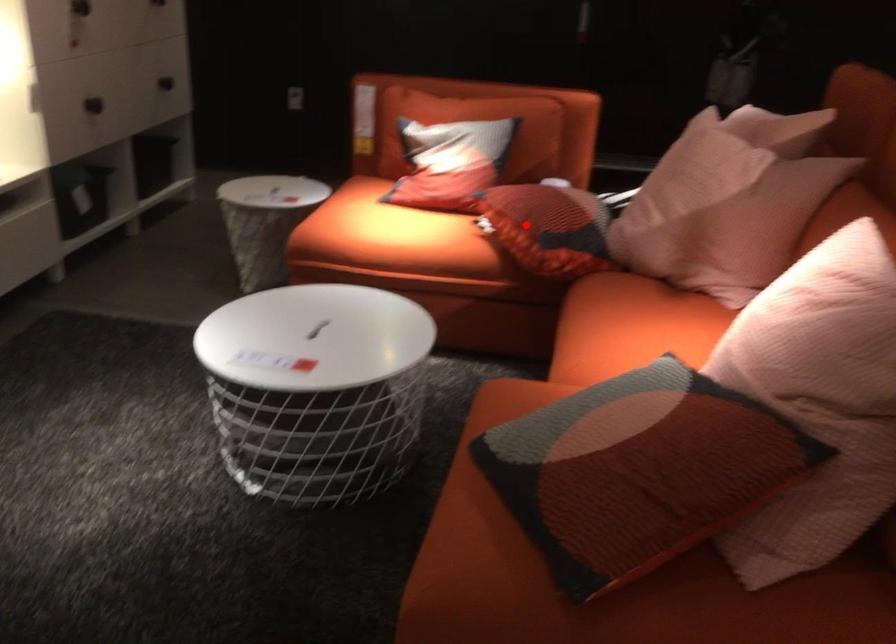
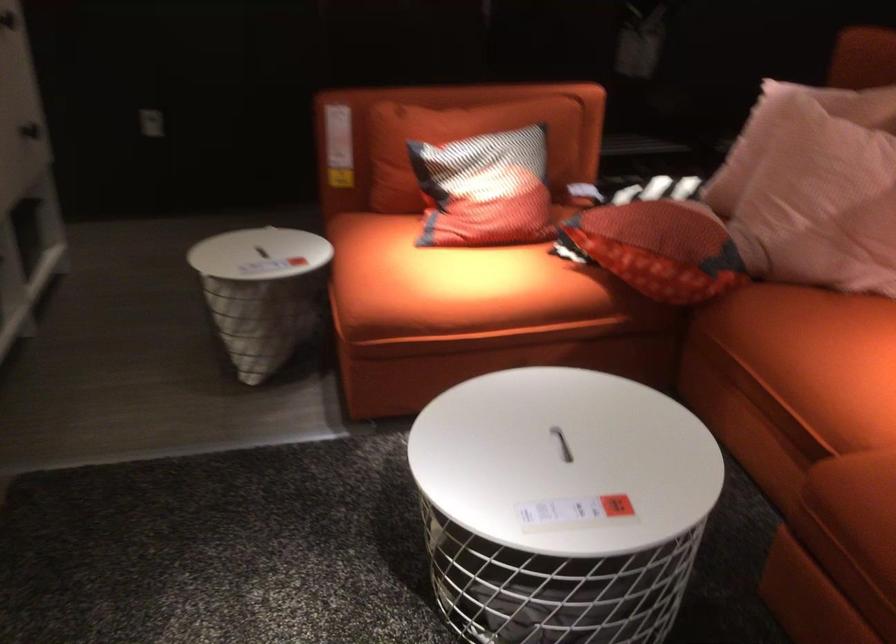
In the second image, find the point that corresponds to the highlighted location in the first image.

(659, 248)